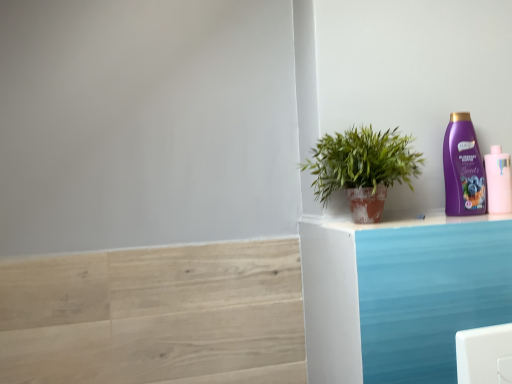
The height and width of the screenshot is (384, 512). In order to click on pink matte bottle at upper right, the first bottle viewed from the right in this screenshot , I will do `click(498, 181)`.

This screenshot has height=384, width=512. What do you see at coordinates (498, 181) in the screenshot?
I see `pink matte bottle at upper right, the second bottle from the left` at bounding box center [498, 181].

Find the location of a particular element. Image resolution: width=512 pixels, height=384 pixels. light wood stair at lower left is located at coordinates (155, 315).

What do you see at coordinates (155, 315) in the screenshot? The height and width of the screenshot is (384, 512). I see `light wood stair at lower left` at bounding box center [155, 315].

The height and width of the screenshot is (384, 512). Describe the element at coordinates (362, 168) in the screenshot. I see `green leafy plant in terracotta pot at right` at that location.

Where is `pink matte bottle at upper right, the second bottle from the left`? pink matte bottle at upper right, the second bottle from the left is located at coordinates (498, 181).

Does pink matte bottle at upper right, the first bottle viewed from the right, contain light wood stair at lower left?

No, light wood stair at lower left is not a part of pink matte bottle at upper right, the first bottle viewed from the right.

The width and height of the screenshot is (512, 384). Find the location of `bottle that is the 1st object above the light wood stair at lower left (from a real-world perspective)`. bottle that is the 1st object above the light wood stair at lower left (from a real-world perspective) is located at coordinates (498, 181).

Is pink matte bottle at upper right, the first bottle viewed from the right, thinner than light wood stair at lower left?

No, pink matte bottle at upper right, the first bottle viewed from the right, is not thinner than light wood stair at lower left.

Which of these two, pink matte bottle at upper right, the first bottle viewed from the right, or light wood stair at lower left, stands taller?

With more height is light wood stair at lower left.

What's the angular difference between purple glossy shampoo bottle at upper right, marked as the second bottle in a right-to-left arrangement, and green leafy plant in terracotta pot at right's facing directions?

purple glossy shampoo bottle at upper right, marked as the second bottle in a right-to-left arrangement, and green leafy plant in terracotta pot at right are facing 0.000919 degrees away from each other.

Is purple glossy shampoo bottle at upper right, the 1th bottle viewed from the left, touching green leafy plant in terracotta pot at right?

No, purple glossy shampoo bottle at upper right, the 1th bottle viewed from the left, is not beside green leafy plant in terracotta pot at right.

From a real-world perspective, which object rests below the other?

green leafy plant in terracotta pot at right.

Is purple glossy shampoo bottle at upper right, the 1th bottle viewed from the left, inside the boundaries of green leafy plant in terracotta pot at right, or outside?

purple glossy shampoo bottle at upper right, the 1th bottle viewed from the left, is not enclosed by green leafy plant in terracotta pot at right.

Identify the location of the 2nd bottle behind when counting from the green leafy plant in terracotta pot at right. coord(498,181).

Is pink matte bottle at upper right, the first bottle viewed from the right, beside green leafy plant in terracotta pot at right?

No.

Which is more distant, (485, 170) or (358, 196)?

The point (485, 170) is behind.

From the image's perspective, is pink matte bottle at upper right, the first bottle viewed from the right, over green leafy plant in terracotta pot at right?

No, from the image's perspective, pink matte bottle at upper right, the first bottle viewed from the right, is not over green leafy plant in terracotta pot at right.

Based on the photo, who is more distant, purple glossy shampoo bottle at upper right, marked as the second bottle in a right-to-left arrangement, or light wood stair at lower left?

Positioned behind is purple glossy shampoo bottle at upper right, marked as the second bottle in a right-to-left arrangement.

Considering the relative sizes of purple glossy shampoo bottle at upper right, marked as the second bottle in a right-to-left arrangement, and light wood stair at lower left in the image provided, is purple glossy shampoo bottle at upper right, marked as the second bottle in a right-to-left arrangement, bigger than light wood stair at lower left?

Actually, purple glossy shampoo bottle at upper right, marked as the second bottle in a right-to-left arrangement, might be smaller than light wood stair at lower left.

Is purple glossy shampoo bottle at upper right, marked as the second bottle in a right-to-left arrangement, not near light wood stair at lower left?

No, purple glossy shampoo bottle at upper right, marked as the second bottle in a right-to-left arrangement, is in close proximity to light wood stair at lower left.

This screenshot has height=384, width=512. What are the coordinates of `stair on the left of green leafy plant in terracotta pot at right` in the screenshot? It's located at (155, 315).

Is light wood stair at lower left bigger than green leafy plant in terracotta pot at right?

Actually, light wood stair at lower left might be smaller than green leafy plant in terracotta pot at right.

Is light wood stair at lower left thinner than green leafy plant in terracotta pot at right?

Indeed, light wood stair at lower left has a lesser width compared to green leafy plant in terracotta pot at right.

In the scene shown: Is light wood stair at lower left aimed at green leafy plant in terracotta pot at right?

No, light wood stair at lower left does not turn towards green leafy plant in terracotta pot at right.

Considering their positions, is purple glossy shampoo bottle at upper right, marked as the second bottle in a right-to-left arrangement, located in front of or behind pink matte bottle at upper right, the first bottle viewed from the right?

purple glossy shampoo bottle at upper right, marked as the second bottle in a right-to-left arrangement, is positioned closer to the viewer than pink matte bottle at upper right, the first bottle viewed from the right.

Measure the distance from purple glossy shampoo bottle at upper right, the 1th bottle viewed from the left, to pink matte bottle at upper right, the first bottle viewed from the right.

They are 2.57 inches apart.

From a real-world perspective, which is physically below, purple glossy shampoo bottle at upper right, the 1th bottle viewed from the left, or pink matte bottle at upper right, the second bottle from the left?

pink matte bottle at upper right, the second bottle from the left, from a real-world perspective.

From the picture: Can you confirm if purple glossy shampoo bottle at upper right, marked as the second bottle in a right-to-left arrangement, is thinner than pink matte bottle at upper right, the first bottle viewed from the right?

Yes.

From a real-world perspective, is green leafy plant in terracotta pot at right above or below light wood stair at lower left?

Clearly, from a real-world perspective, green leafy plant in terracotta pot at right is above light wood stair at lower left.

Which object is positioned more to the left, green leafy plant in terracotta pot at right or light wood stair at lower left?

light wood stair at lower left.

Is green leafy plant in terracotta pot at right oriented away from light wood stair at lower left?

No, green leafy plant in terracotta pot at right is not facing away from light wood stair at lower left.

From the light wood stair at lower left, count 2nd bottles backward and point to it. Please provide its 2D coordinates.

[(498, 181)]

Where is `the 1st bottle counting from the right side of the green leafy plant in terracotta pot at right`? The height and width of the screenshot is (384, 512). the 1st bottle counting from the right side of the green leafy plant in terracotta pot at right is located at coordinates (463, 168).

From the image, which object appears to be farther from purple glossy shampoo bottle at upper right, marked as the second bottle in a right-to-left arrangement, pink matte bottle at upper right, the first bottle viewed from the right, or green leafy plant in terracotta pot at right?

Based on the image, green leafy plant in terracotta pot at right appears to be further to purple glossy shampoo bottle at upper right, marked as the second bottle in a right-to-left arrangement.

Which object lies nearer to the anchor point pink matte bottle at upper right, the second bottle from the left, purple glossy shampoo bottle at upper right, the 1th bottle viewed from the left, or light wood stair at lower left?

purple glossy shampoo bottle at upper right, the 1th bottle viewed from the left.

Looking at the image, which one is located closer to light wood stair at lower left, purple glossy shampoo bottle at upper right, the 1th bottle viewed from the left, or pink matte bottle at upper right, the second bottle from the left?

The object closer to light wood stair at lower left is purple glossy shampoo bottle at upper right, the 1th bottle viewed from the left.

Considering their positions, is green leafy plant in terracotta pot at right positioned closer to pink matte bottle at upper right, the second bottle from the left, than light wood stair at lower left?

The object closer to pink matte bottle at upper right, the second bottle from the left, is green leafy plant in terracotta pot at right.

From the image, which object appears to be farther from light wood stair at lower left, pink matte bottle at upper right, the second bottle from the left, or green leafy plant in terracotta pot at right?

pink matte bottle at upper right, the second bottle from the left.

When comparing their distances from green leafy plant in terracotta pot at right, does light wood stair at lower left or pink matte bottle at upper right, the second bottle from the left, seem further?

Based on the image, light wood stair at lower left appears to be further to green leafy plant in terracotta pot at right.

Looking at the image, which one is located closer to light wood stair at lower left, green leafy plant in terracotta pot at right or pink matte bottle at upper right, the second bottle from the left?

green leafy plant in terracotta pot at right is closer to light wood stair at lower left.

Looking at the image, which one is located closer to green leafy plant in terracotta pot at right, purple glossy shampoo bottle at upper right, the 1th bottle viewed from the left, or pink matte bottle at upper right, the second bottle from the left?

purple glossy shampoo bottle at upper right, the 1th bottle viewed from the left, lies closer to green leafy plant in terracotta pot at right than the other object.

Locate an element on the screen. The height and width of the screenshot is (384, 512). houseplant between light wood stair at lower left and purple glossy shampoo bottle at upper right, marked as the second bottle in a right-to-left arrangement, from left to right is located at coordinates (362, 168).

The height and width of the screenshot is (384, 512). Identify the location of bottle between green leafy plant in terracotta pot at right and pink matte bottle at upper right, the second bottle from the left, in the horizontal direction. (463, 168).

Locate an element on the screen. This screenshot has height=384, width=512. bottle located between light wood stair at lower left and pink matte bottle at upper right, the second bottle from the left, in the left-right direction is located at coordinates (463, 168).

Locate an element on the screen. This screenshot has width=512, height=384. houseplant between light wood stair at lower left and pink matte bottle at upper right, the second bottle from the left is located at coordinates (362, 168).